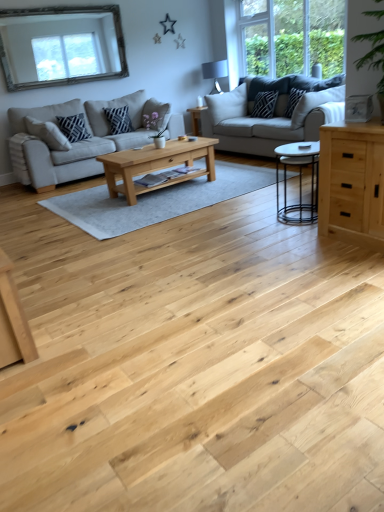
Question: Considering the relative positions of light gray fabric couch at left, marked as the first studio couch in a left-to-right arrangement, and light gray fabric couch at center, which appears as the second studio couch when viewed from the left, in the image provided, is light gray fabric couch at left, marked as the first studio couch in a left-to-right arrangement, to the right of light gray fabric couch at center, which appears as the second studio couch when viewed from the left, from the viewer's perspective?

Choices:
 (A) no
 (B) yes

Answer: (A)

Question: Is light gray fabric couch at left, marked as the first studio couch in a left-to-right arrangement, located outside light gray fabric couch at center, which appears as the second studio couch when viewed from the left?

Choices:
 (A) no
 (B) yes

Answer: (B)

Question: From the image's perspective, is light gray fabric couch at left, the second studio couch when ordered from right to left, over light gray fabric couch at center, which appears as the second studio couch when viewed from the left?

Choices:
 (A) yes
 (B) no

Answer: (B)

Question: Considering the relative sizes of light gray fabric couch at left, marked as the first studio couch in a left-to-right arrangement, and light gray fabric couch at center, the 1th studio couch viewed from the right, in the image provided, is light gray fabric couch at left, marked as the first studio couch in a left-to-right arrangement, wider than light gray fabric couch at center, the 1th studio couch viewed from the right,?

Choices:
 (A) yes
 (B) no

Answer: (A)

Question: Does light gray fabric couch at left, the second studio couch when ordered from right to left, have a lesser width compared to light gray fabric couch at center, the 1th studio couch viewed from the right?

Choices:
 (A) yes
 (B) no

Answer: (B)

Question: Considering the positions of point (82, 130) and point (114, 110), is point (82, 130) closer or farther from the camera than point (114, 110)?

Choices:
 (A) closer
 (B) farther

Answer: (A)

Question: From the image's perspective, is matte black pillow at left, arranged as the first pillow when viewed from the left, above or below matte black pillow at center-left, which ranks as the second pillow in left-to-right order?

Choices:
 (A) below
 (B) above

Answer: (A)

Question: Considering their positions, is matte black pillow at left, positioned as the 4th pillow in right-to-left order, located in front of or behind matte black pillow at center-left, which ranks as the second pillow in left-to-right order?

Choices:
 (A) front
 (B) behind

Answer: (A)

Question: Is matte black pillow at left, arranged as the first pillow when viewed from the left, wider or thinner than matte black pillow at center-left, the third pillow viewed from the right?

Choices:
 (A) wide
 (B) thin

Answer: (B)

Question: From a real-world perspective, is black metal coffee table at center, positioned as the second coffee table in left-to-right order, physically located above or below black textured pillow at upper right, which ranks as the 3th pillow in left-to-right order?

Choices:
 (A) below
 (B) above

Answer: (A)

Question: Is black metal coffee table at center, which is the first coffee table from front to back, to the left or to the right of black textured pillow at upper right, the second pillow positioned from the right, in the image?

Choices:
 (A) left
 (B) right

Answer: (A)

Question: Considering the positions of black metal coffee table at center, the 2th coffee table in the back-to-front sequence, and black textured pillow at upper right, the second pillow positioned from the right, in the image, is black metal coffee table at center, the 2th coffee table in the back-to-front sequence, wider or thinner than black textured pillow at upper right, the second pillow positioned from the right,?

Choices:
 (A) wide
 (B) thin

Answer: (A)

Question: Considering the positions of point (304, 159) and point (256, 104), is point (304, 159) closer or farther from the camera than point (256, 104)?

Choices:
 (A) closer
 (B) farther

Answer: (A)

Question: Is point (286, 143) closer or farther from the camera than point (211, 91)?

Choices:
 (A) closer
 (B) farther

Answer: (A)

Question: From the image's perspective, is black metal coffee table at center, positioned as the second coffee table in left-to-right order, above or below matte black lampshade at upper center?

Choices:
 (A) above
 (B) below

Answer: (B)